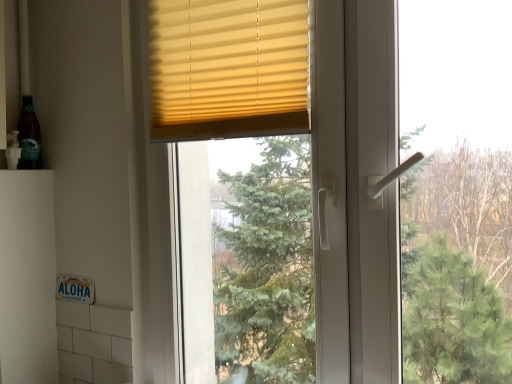
Question: Is yellow matte blinds at upper center bigger or smaller than translucent glass bottle at left?

Choices:
 (A) big
 (B) small

Answer: (A)

Question: Considering the relative positions of yellow matte blinds at upper center and translucent glass bottle at left in the image provided, is yellow matte blinds at upper center to the left or to the right of translucent glass bottle at left?

Choices:
 (A) right
 (B) left

Answer: (A)

Question: Is yellow matte blinds at upper center in front of or behind translucent glass bottle at left in the image?

Choices:
 (A) front
 (B) behind

Answer: (A)

Question: From the image's perspective, relative to yellow matte blinds at upper center, is translucent glass bottle at left above or below?

Choices:
 (A) above
 (B) below

Answer: (B)

Question: Based on their sizes in the image, would you say translucent glass bottle at left is bigger or smaller than yellow matte blinds at upper center?

Choices:
 (A) big
 (B) small

Answer: (B)

Question: In the image, is translucent glass bottle at left positioned in front of or behind yellow matte blinds at upper center?

Choices:
 (A) behind
 (B) front

Answer: (A)

Question: Visually, is translucent glass bottle at left positioned to the left or to the right of yellow matte blinds at upper center?

Choices:
 (A) right
 (B) left

Answer: (B)